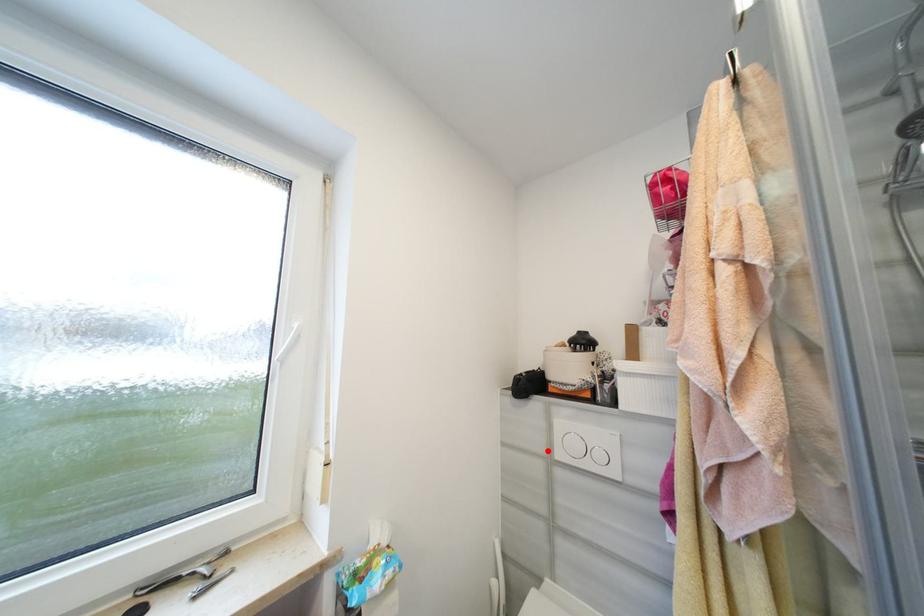
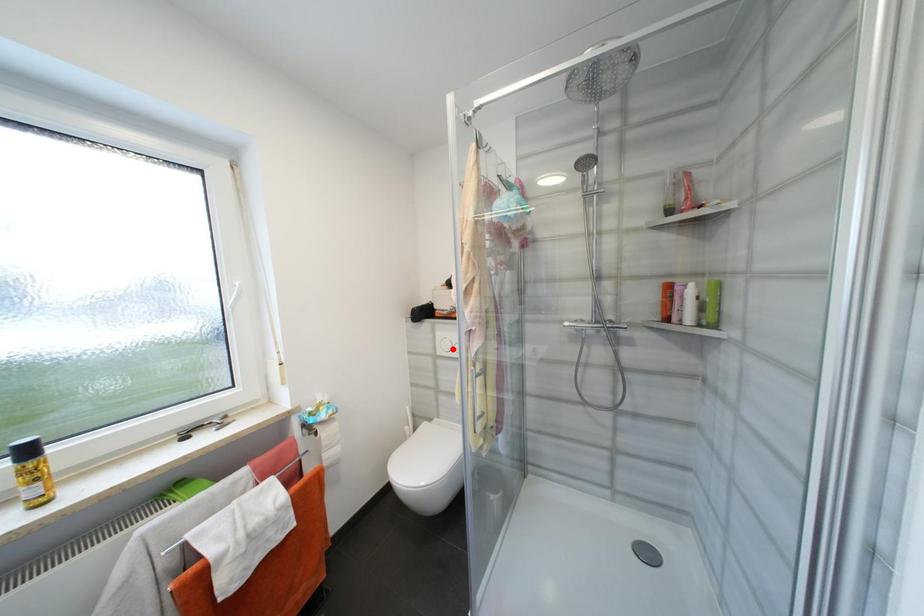
I am providing you with two images of the same scene from different viewpoints. A red point is marked on the first image and another point is marked on the second image. Does the point marked in image1 correspond to the same location as the one in image2?

No